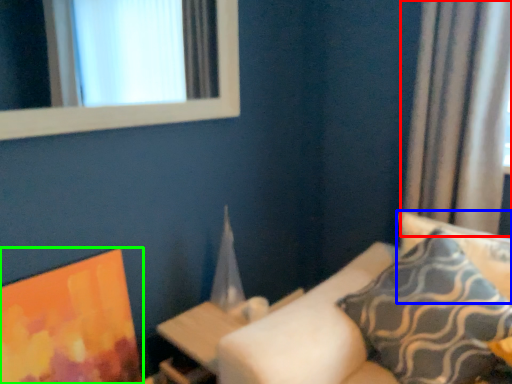
Question: Estimate the real-world distances between objects in this image. Which object is closer to curtain (highlighted by a red box), pillow (highlighted by a blue box) or picture frame (highlighted by a green box)?

Choices:
 (A) pillow
 (B) picture frame

Answer: (A)